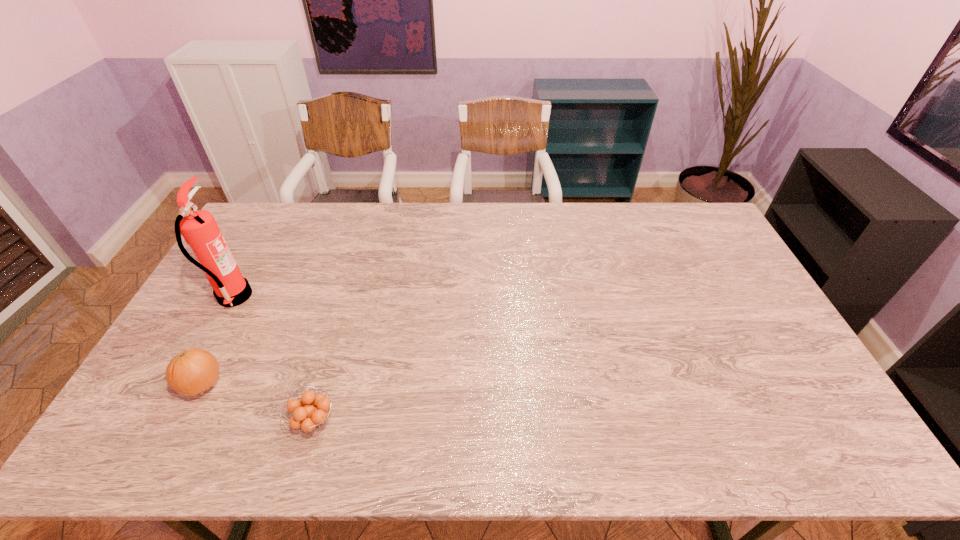
Locate an element on the screen. Image resolution: width=960 pixels, height=540 pixels. the tallest object is located at coordinates (199, 229).

Identify the location of fire extinguisher. Image resolution: width=960 pixels, height=540 pixels. (199, 229).

At what (x,y) coordinates should I click in order to perform the action: click on the taller orange fruit. Please return your answer as a coordinate pair (x, y). Image resolution: width=960 pixels, height=540 pixels. Looking at the image, I should click on (191, 372).

Image resolution: width=960 pixels, height=540 pixels. In order to click on the second shortest object in this screenshot , I will do `click(191, 372)`.

I want to click on the rightmost object, so click(308, 417).

The image size is (960, 540). What are the coordinates of `the right orange fruit` in the screenshot? It's located at (308, 417).

Where is `free space located with the nozzle aimed from the tallest object`? The image size is (960, 540). free space located with the nozzle aimed from the tallest object is located at coordinates (288, 297).

This screenshot has width=960, height=540. I want to click on blank space located on the back of the left orange fruit, so click(x=234, y=323).

Identify the location of free space located 0.050m on the left of the shorter orange fruit. (270, 421).

The width and height of the screenshot is (960, 540). What are the coordinates of `object present at the near edge` in the screenshot? It's located at (308, 417).